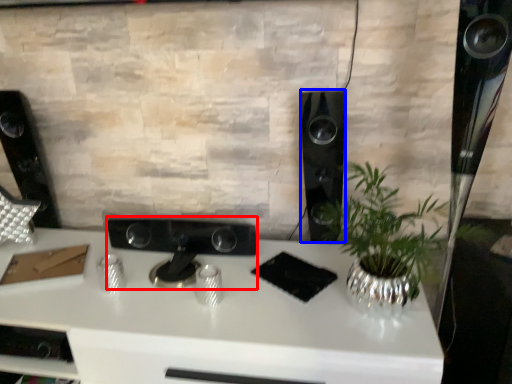
Question: Which object is further to the camera taking this photo, appliance (highlighted by a red box) or speaker (highlighted by a blue box)?

Choices:
 (A) appliance
 (B) speaker

Answer: (A)